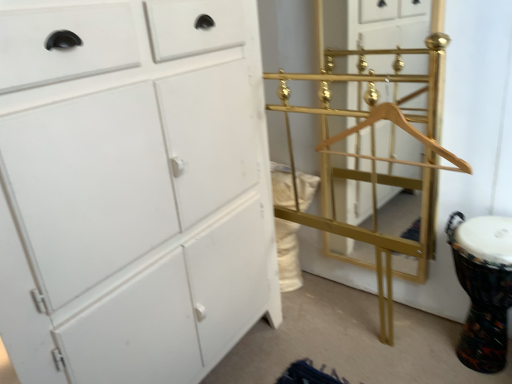
Question: From a real-world perspective, is white matte cabinet at left physically located above or below multicolored fabric drum at lower right?

Choices:
 (A) below
 (B) above

Answer: (B)

Question: Is white matte cabinet at left wider or thinner than multicolored fabric drum at lower right?

Choices:
 (A) thin
 (B) wide

Answer: (B)

Question: Which of these objects is positioned farthest from the white matte cabinet at left?

Choices:
 (A) multicolored fabric drum at lower right
 (B) gold metallic bunk bed at right
 (C) gold metallic coat rack at center

Answer: (C)

Question: Which is nearer to the gold metallic bunk bed at right?

Choices:
 (A) white matte cabinet at left
 (B) multicolored fabric drum at lower right
 (C) gold metallic coat rack at center

Answer: (C)